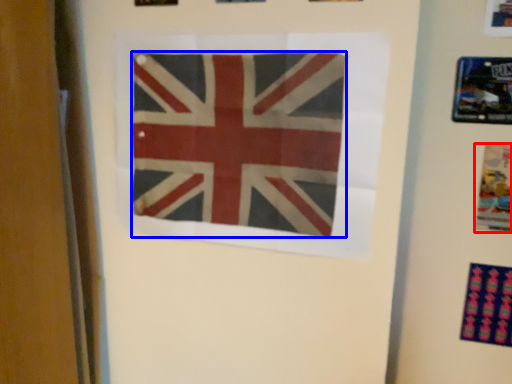
Question: Among these objects, which one is farthest to the camera, poster (highlighted by a red box) or flag (highlighted by a blue box)?

Choices:
 (A) poster
 (B) flag

Answer: (A)